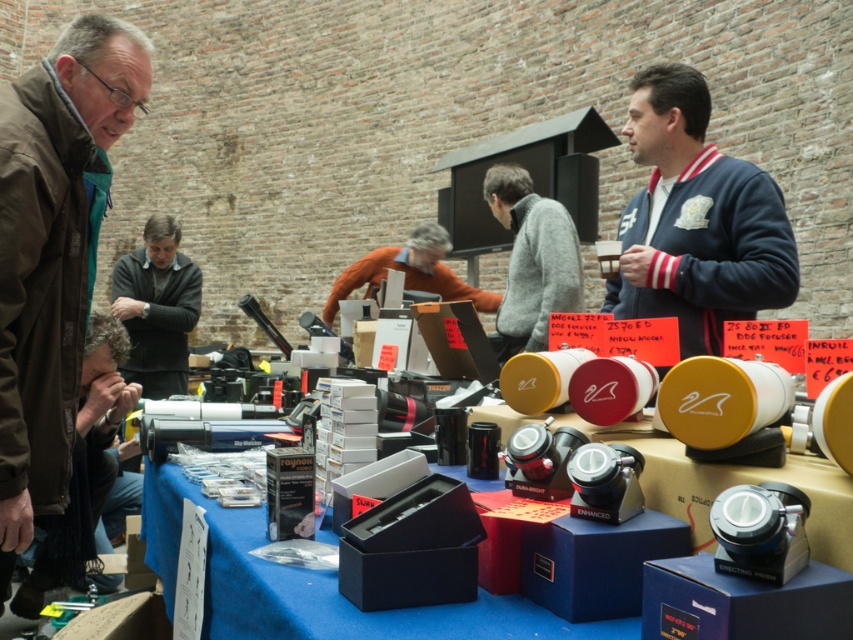
From the picture: Between blue cardboard boxes at center and orange sweater at center, which one is positioned higher?

orange sweater at center is higher up.

Image resolution: width=853 pixels, height=640 pixels. What do you see at coordinates (312, 586) in the screenshot?
I see `blue cardboard boxes at center` at bounding box center [312, 586].

Where is `blue cardboard boxes at center`? This screenshot has height=640, width=853. blue cardboard boxes at center is located at coordinates (312, 586).

Is the position of navy blue fleece at center less distant than that of orange sweater at center?

Yes, navy blue fleece at center is in front of orange sweater at center.

Is point (741, 234) less distant than point (403, 260)?

Yes.

This screenshot has height=640, width=853. In order to click on navy blue fleece at center in this screenshot , I will do pyautogui.click(x=695, y=220).

You are a GUI agent. You are given a task and a screenshot of the screen. Output one action in this format:
    pyautogui.click(x=<x>, y=<y>)
    Task: Click on the brown leather jacket at left
    
    Given the screenshot: What is the action you would take?
    pyautogui.click(x=53, y=252)

Can you confirm if brown leather jacket at left is taller than blue cardboard boxes at center?

Yes.

I want to click on brown leather jacket at left, so click(x=53, y=252).